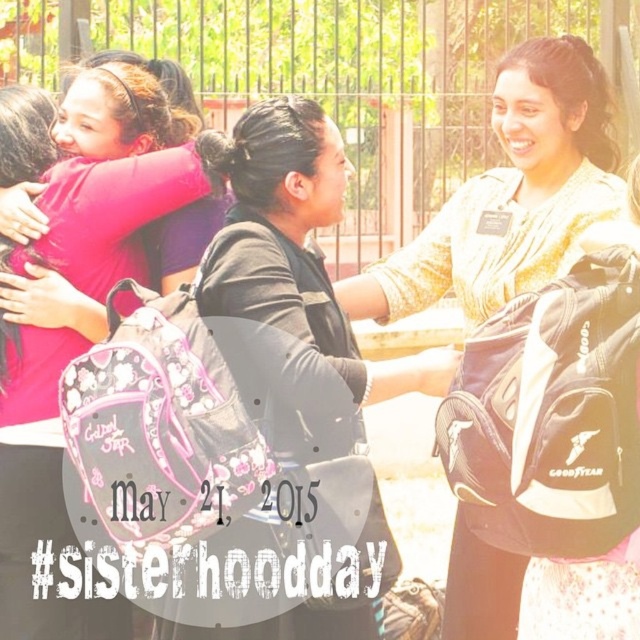
Between matte black backpack at center and black matte backpack at center, which one is positioned lower?

matte black backpack at center

Can you confirm if matte black backpack at center is wider than black matte backpack at center?

In fact, matte black backpack at center might be narrower than black matte backpack at center.

What do you see at coordinates (509, 195) in the screenshot? I see `matte black backpack at center` at bounding box center [509, 195].

The width and height of the screenshot is (640, 640). What are the coordinates of `matte black backpack at center` in the screenshot? It's located at point(509,195).

Does matte black backpack at center have a smaller size compared to pink fabric at left?

Indeed, matte black backpack at center has a smaller size compared to pink fabric at left.

Does point (465, 573) lie in front of point (140, 156)?

No, (465, 573) is behind (140, 156).

Image resolution: width=640 pixels, height=640 pixels. I want to click on matte black backpack at center, so click(509, 195).

Does pink fabric at left appear under black matte backpack at center?

Yes, pink fabric at left is below black matte backpack at center.

In the scene shown: Which is more to the right, pink fabric at left or black matte backpack at center?

Positioned to the right is black matte backpack at center.

Does point (115, 61) come closer to viewer compared to point (326, 326)?

No.

Identify the location of pink fabric at left. The height and width of the screenshot is (640, 640). (38, 488).